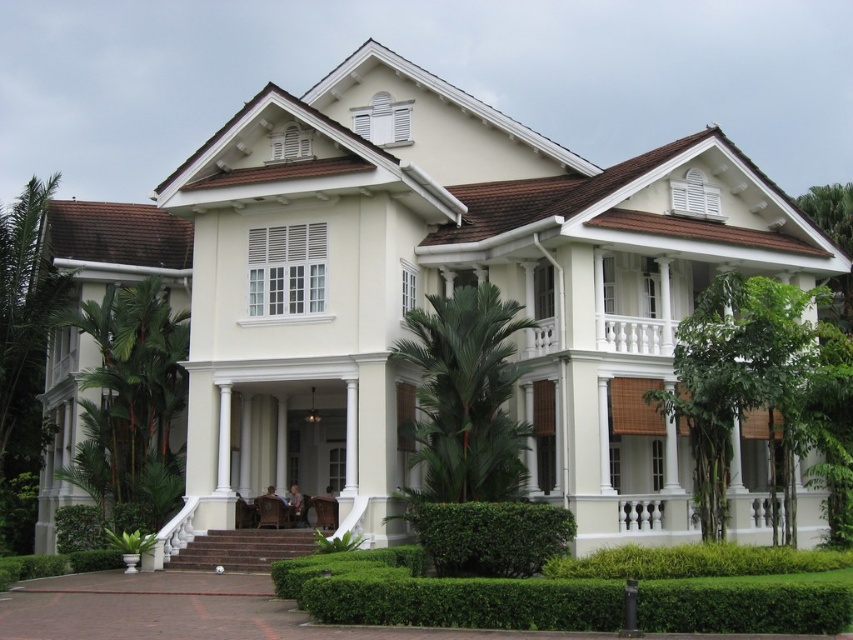
Between green leafy hedge at lower center and green leafy hedge at lower left, which one has more height?

green leafy hedge at lower left is taller.

Between green leafy hedge at lower center and green leafy hedge at lower left, which one appears on the left side from the viewer's perspective?

green leafy hedge at lower left

Is point (546, 525) positioned before point (91, 524)?

Yes.

The height and width of the screenshot is (640, 853). Identify the location of green leafy hedge at lower center. (490, 536).